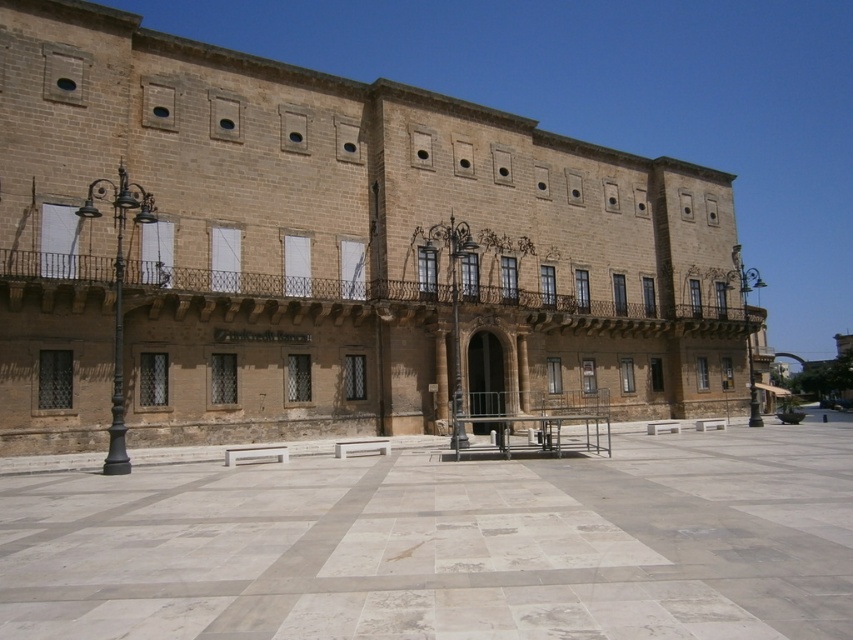
Question: Among these points, which one is farthest from the camera?

Choices:
 (A) (45, 67)
 (B) (700, 228)

Answer: (B)

Question: Which point is closer to the camera?

Choices:
 (A) matte stone square at upper center
 (B) matte stone square at upper left
 (C) marble tiles at center

Answer: (C)

Question: Estimate the real-world distances between objects in this image. Which object is farther from the matte stone square at upper left?

Choices:
 (A) marble tiles at center
 (B) matte stone square at upper center

Answer: (A)

Question: Does marble tiles at center appear on the right side of matte stone square at upper center?

Choices:
 (A) no
 (B) yes

Answer: (B)

Question: Does marble tiles at center appear under matte stone square at upper center?

Choices:
 (A) no
 (B) yes

Answer: (B)

Question: Can you confirm if marble tiles at center is thinner than matte stone square at upper center?

Choices:
 (A) yes
 (B) no

Answer: (B)